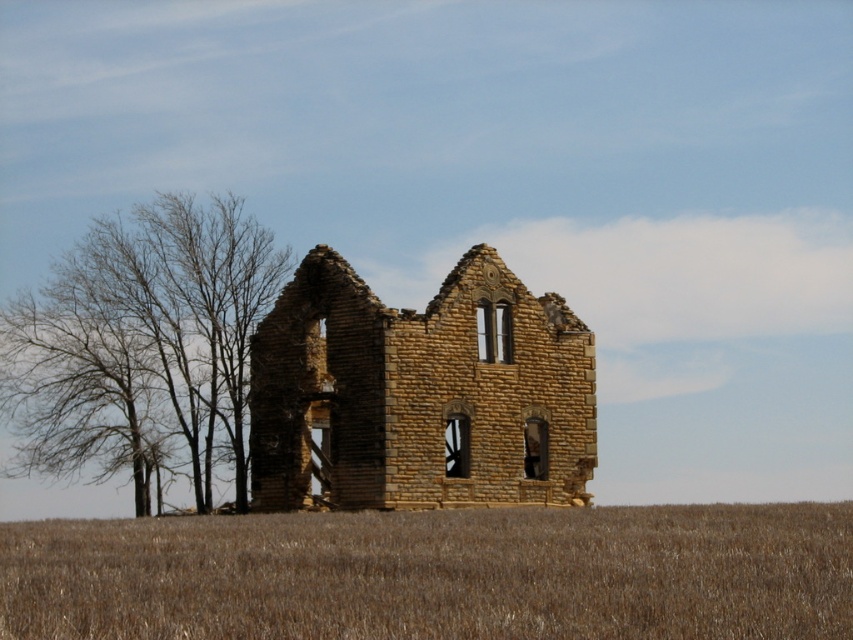
Question: Where is brown grassland at lower center located in relation to brown stone ruins at center in the image?

Choices:
 (A) above
 (B) below

Answer: (B)

Question: Is brown grassland at lower center thinner than bare branches at left?

Choices:
 (A) yes
 (B) no

Answer: (B)

Question: Which object is farther from the camera taking this photo?

Choices:
 (A) bare branches at left
 (B) brown grassland at lower center
 (C) brown stone ruins at center

Answer: (A)

Question: Among these points, which one is farthest from the camera?

Choices:
 (A) (561, 365)
 (B) (669, 564)

Answer: (A)

Question: Which point is farther from the camera taking this photo?

Choices:
 (A) (142, 285)
 (B) (672, 547)

Answer: (A)

Question: Does brown grassland at lower center have a larger size compared to bare branches at left?

Choices:
 (A) yes
 (B) no

Answer: (A)